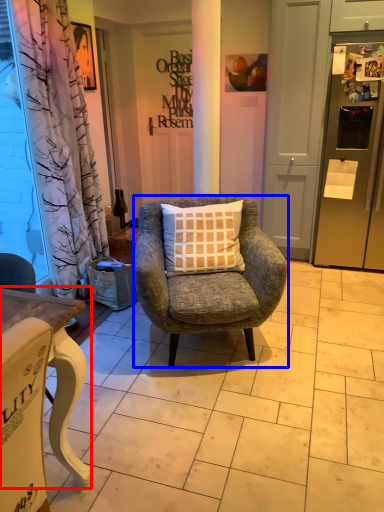
Question: Which object is closer to the camera taking this photo, desk (highlighted by a red box) or chair (highlighted by a blue box)?

Choices:
 (A) desk
 (B) chair

Answer: (A)